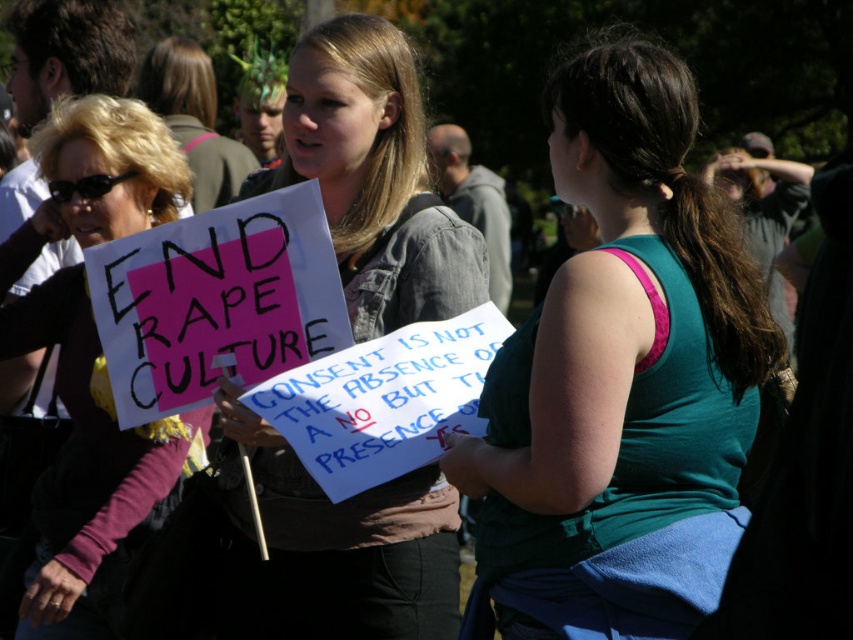
Is teal fabric tank top at center further to camera compared to blonde hair at upper left?

No.

Who is higher up, teal fabric tank top at center or blonde hair at upper left?

blonde hair at upper left is higher up.

This screenshot has height=640, width=853. In order to click on teal fabric tank top at center in this screenshot , I will do `click(619, 340)`.

Between matte black sign at left and blonde hair at upper left, which one is positioned lower?

matte black sign at left

Does point (62, 125) come behind point (172, 116)?

No, (62, 125) is in front of (172, 116).

This screenshot has height=640, width=853. Describe the element at coordinates (85, 468) in the screenshot. I see `matte black sign at left` at that location.

You are a GUI agent. You are given a task and a screenshot of the screen. Output one action in this format:
    pyautogui.click(x=<x>, y=<y>)
    Task: Click on the matte black sign at left
    The width and height of the screenshot is (853, 640).
    Given the screenshot: What is the action you would take?
    pyautogui.click(x=85, y=468)

Is point (482, 275) less distant than point (158, 93)?

That is True.

Between denim jacket at center and blonde hair at upper left, which one is positioned higher?

blonde hair at upper left

Find the location of `denim jacket at center`. denim jacket at center is located at coordinates (374, 177).